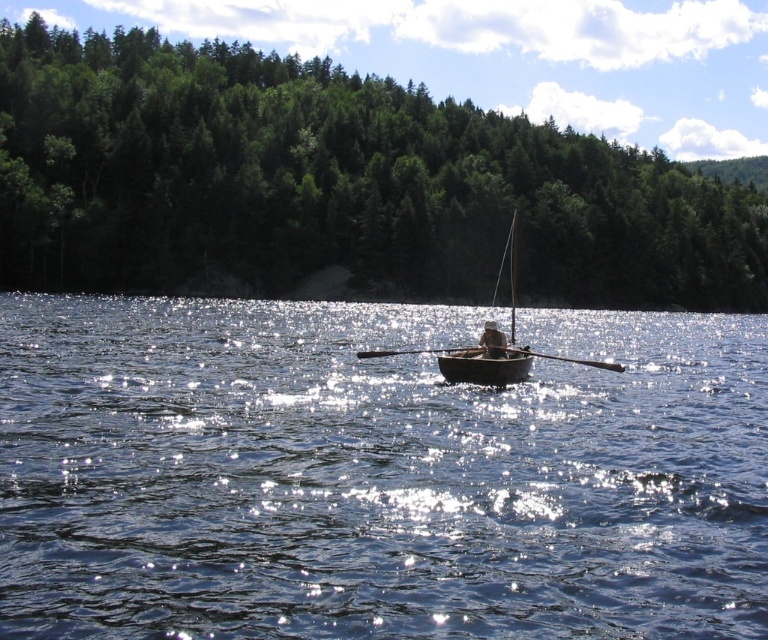
Question: Which of the following is the farthest from the observer?

Choices:
 (A) wooden boat at center
 (B) gray fabric person at center
 (C) wooden at center
 (D) blue reflective water at center

Answer: (B)

Question: Considering the real-world distances, which object is closest to the wooden at center?

Choices:
 (A) gray fabric person at center
 (B) blue reflective water at center
 (C) wooden canoe at center

Answer: (C)

Question: Is wooden boat at center above wooden at center?

Choices:
 (A) yes
 (B) no

Answer: (A)

Question: Is green leafy trees at center positioned behind wooden boat at center?

Choices:
 (A) yes
 (B) no

Answer: (A)

Question: Can you confirm if wooden at center is bigger than gray fabric person at center?

Choices:
 (A) no
 (B) yes

Answer: (B)

Question: Considering the real-world distances, which object is farthest from the gray fabric person at center?

Choices:
 (A) wooden canoe at center
 (B) green leafy trees at center
 (C) blue reflective water at center
 (D) wooden at center

Answer: (B)